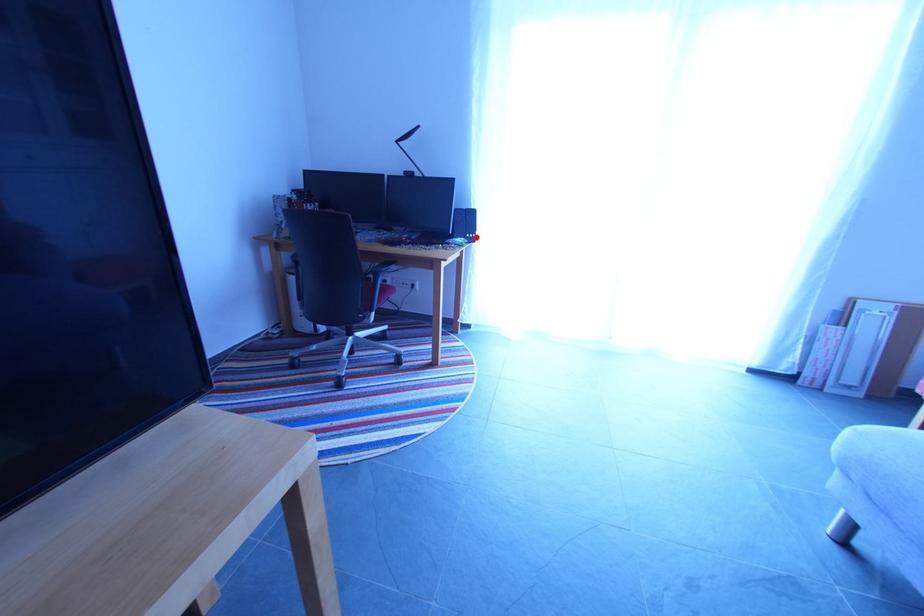
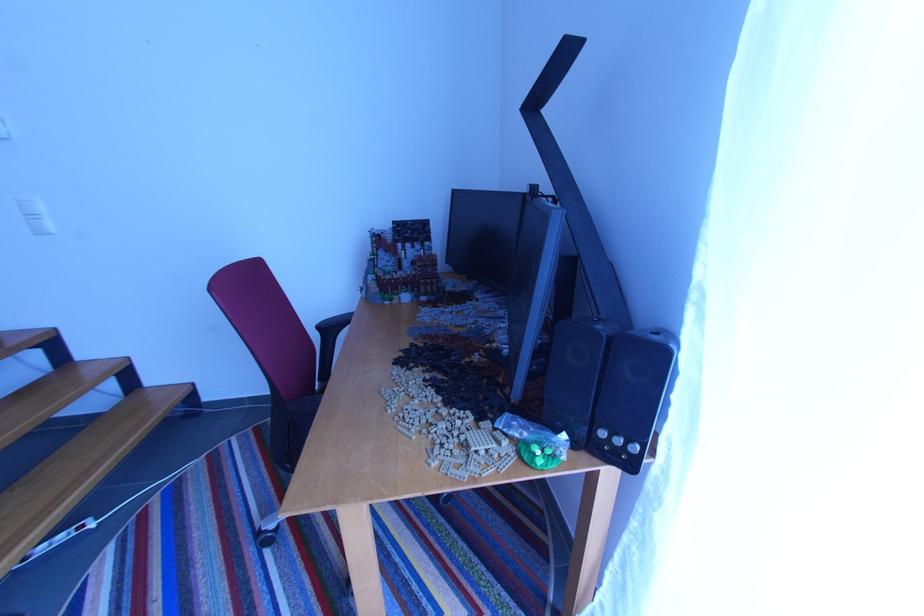
Question: A red point is marked in image1. In image2, is the corresponding 3D point closer to the camera or farther? Reply with the corresponding letter.

Choices:
 (A) The corresponding 3D point is closer.
 (B) The corresponding 3D point is farther.

Answer: (B)